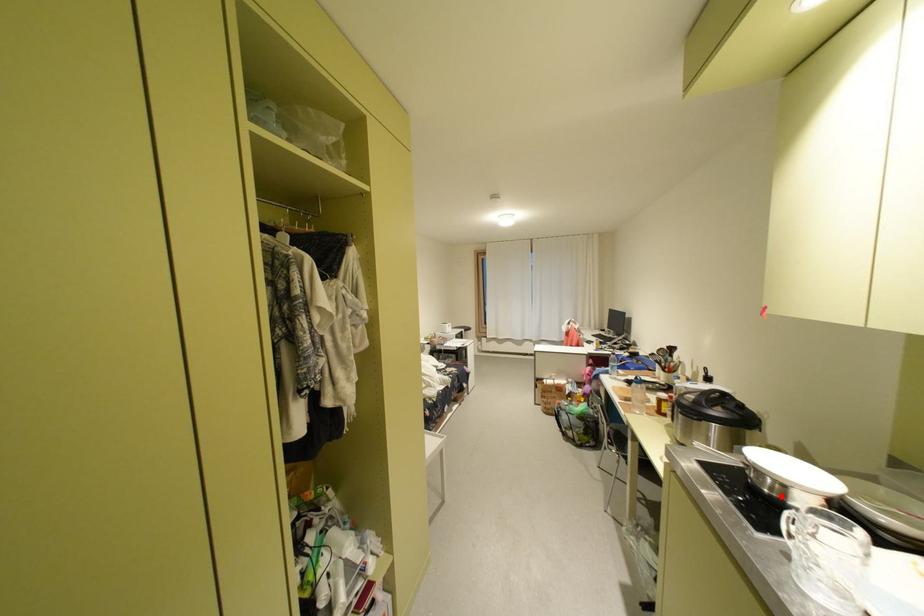
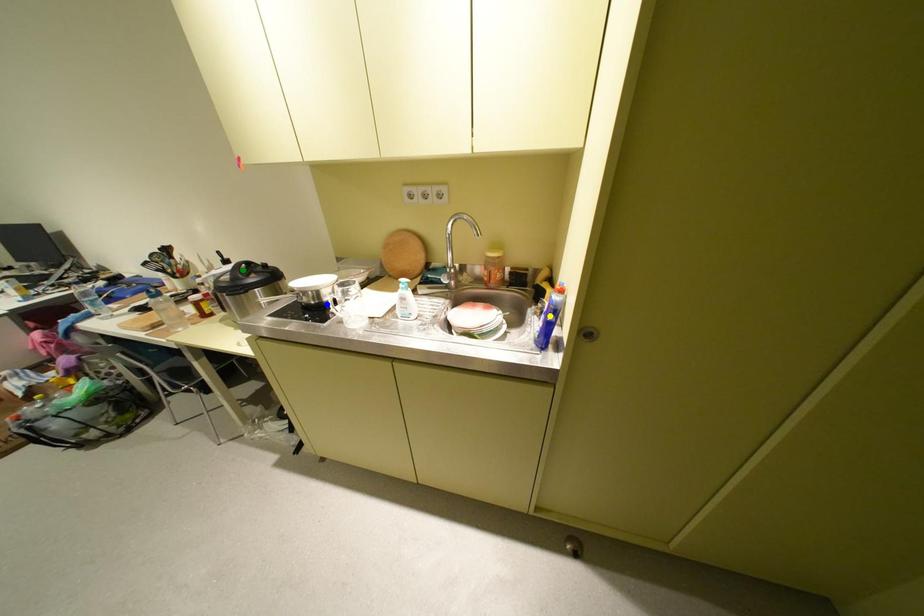
Question: I am providing you with two images of the same scene from different viewpoints. A red point is marked on the first image. You are given multiple points on the second image. Can you choose the point in image 2 that corresponds to the point in image 1?

Choices:
 (A) yellow point
 (B) green point
 (C) blue point

Answer: (C)